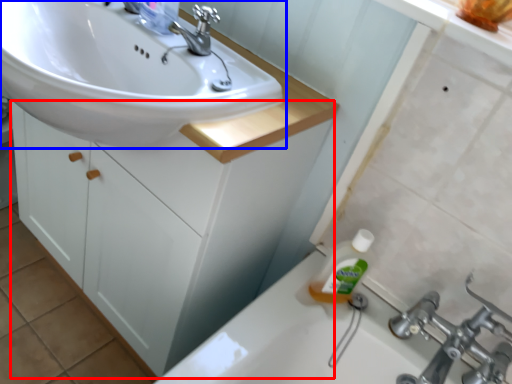
Question: Which point is closer to the camera, bathroom cabinet (highlighted by a red box) or sink (highlighted by a blue box)?

Choices:
 (A) bathroom cabinet
 (B) sink

Answer: (B)